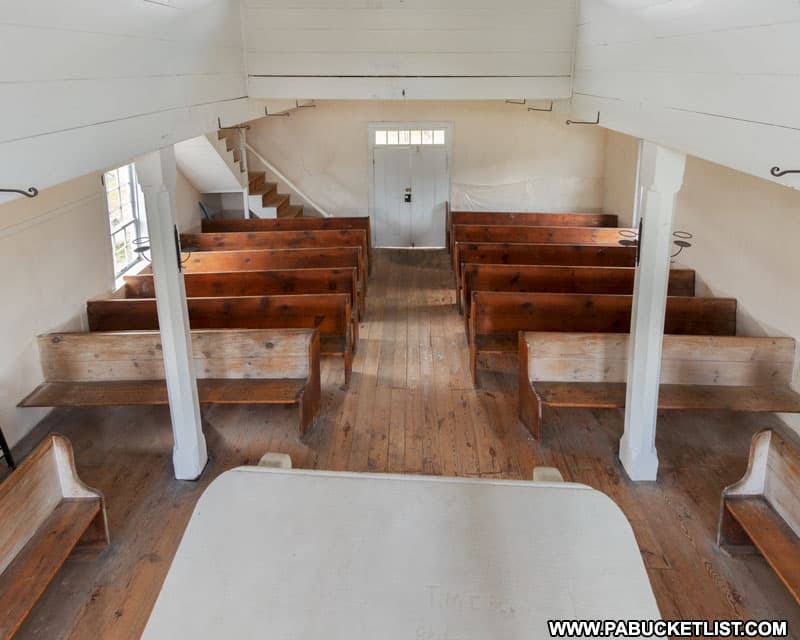
The image size is (800, 640). I want to click on pillar, so click(x=178, y=331), click(x=658, y=310).